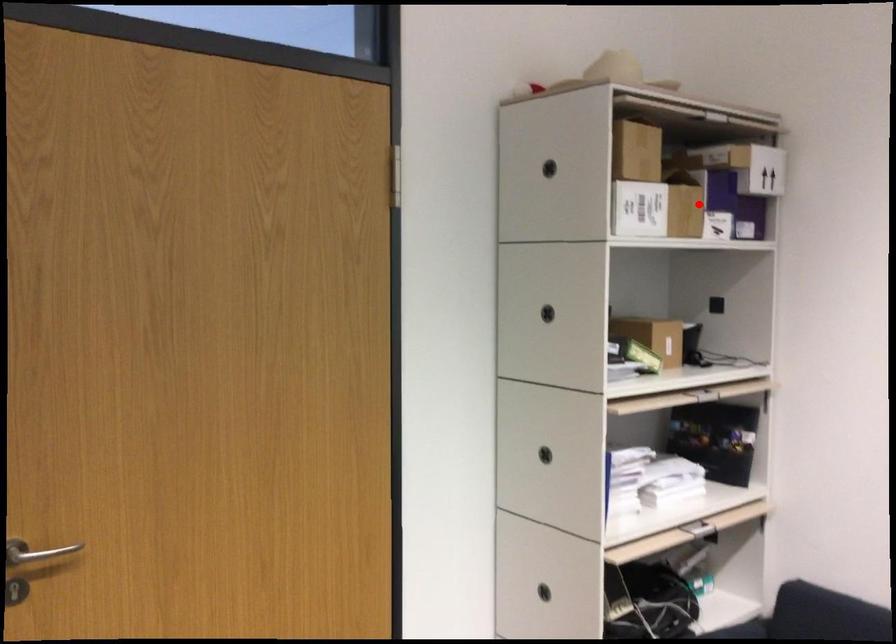
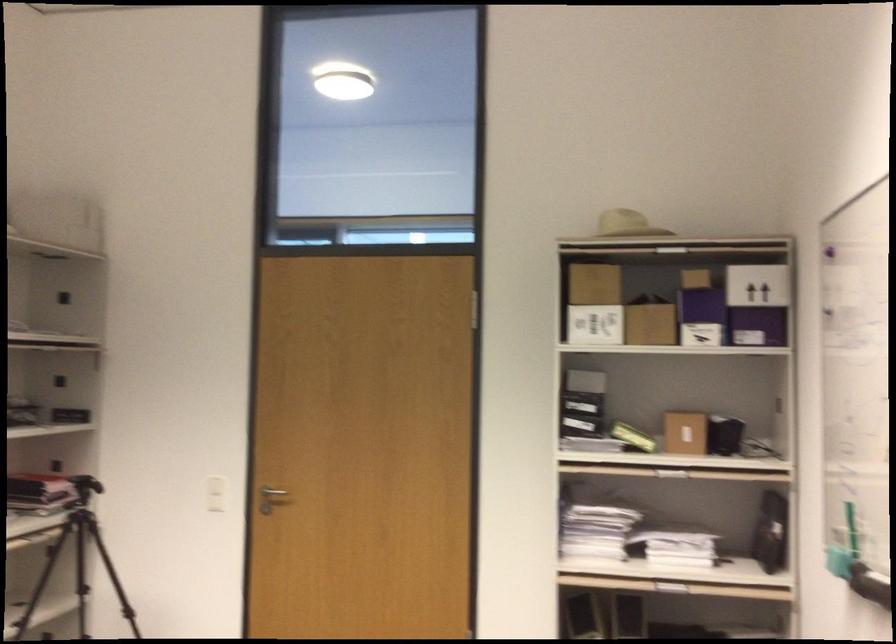
Question: A red point is marked in image1. In image2, is the corresponding 3D point closer to the camera or farther? Reply with the corresponding letter.

Choices:
 (A) The corresponding 3D point is closer.
 (B) The corresponding 3D point is farther.

Answer: (B)